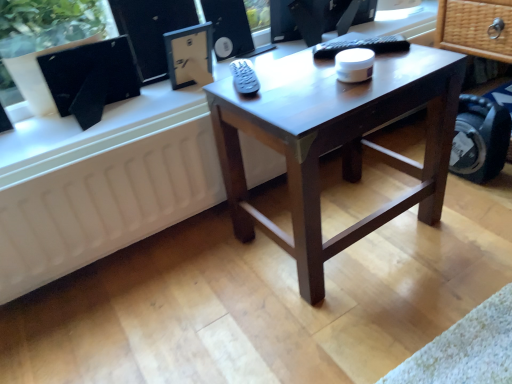
Locate an element on the screen. This screenshot has width=512, height=384. free space on the front side of black matte computer monitor at upper left is located at coordinates (86, 135).